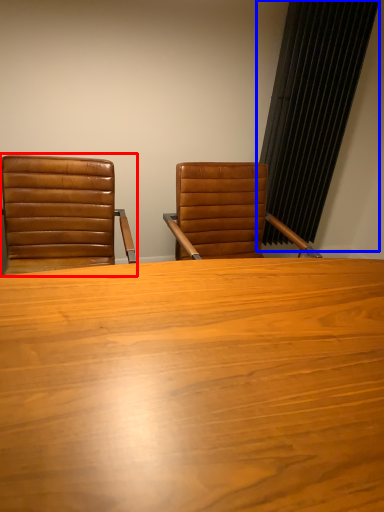
Question: Which point is further to the camera, chair (highlighted by a red box) or curtain (highlighted by a blue box)?

Choices:
 (A) chair
 (B) curtain

Answer: (B)